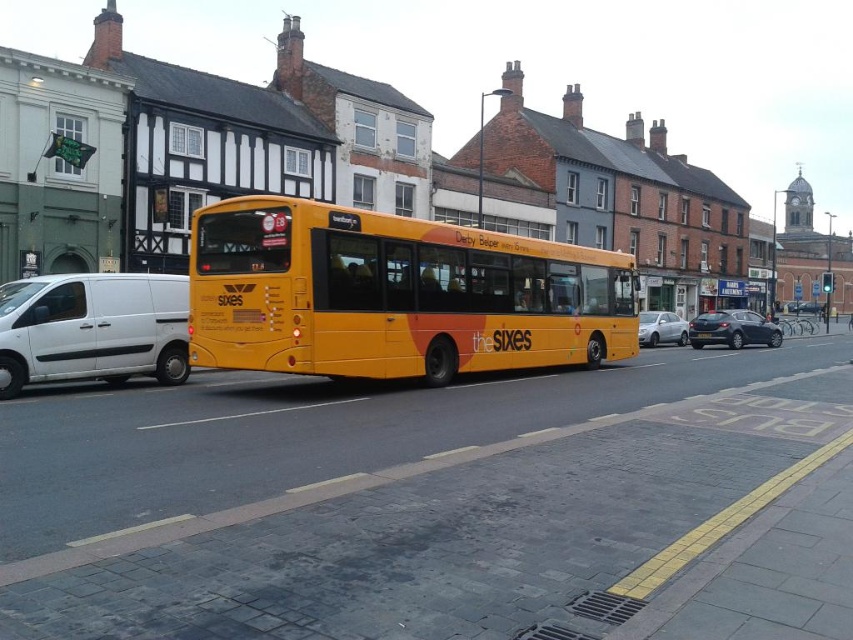
Question: Does yellow matte bus at center appear over dark gray metallic car at right?

Choices:
 (A) no
 (B) yes

Answer: (B)

Question: Which is farther from the yellow matte bus at center?

Choices:
 (A) dark gray metallic car at right
 (B) yellow matte license plate at center
 (C) white matte van at left
 (D) silver metallic sedan at center

Answer: (A)

Question: Which of the following is the farthest from the observer?

Choices:
 (A) yellow matte license plate at center
 (B) white matte van at left

Answer: (A)

Question: Does yellow matte bus at center lie in front of white matte van at left?

Choices:
 (A) yes
 (B) no

Answer: (B)

Question: Can you confirm if silver metallic sedan at center is positioned to the left of yellow matte license plate at center?

Choices:
 (A) yes
 (B) no

Answer: (B)

Question: Which of these objects is positioned closest to the yellow matte license plate at center?

Choices:
 (A) dark gray metallic car at right
 (B) silver metallic sedan at center
 (C) yellow matte bus at center

Answer: (B)